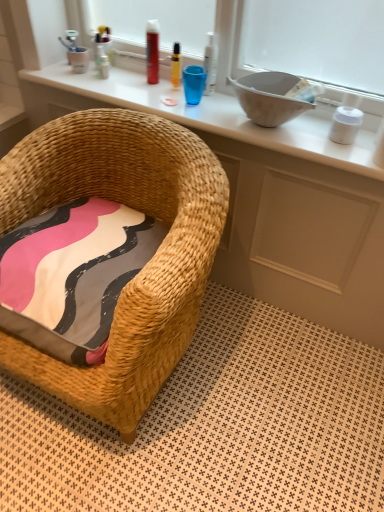
Locate an element on the screen. The height and width of the screenshot is (512, 384). free spot to the right of woven straw chair at lower left is located at coordinates (276, 391).